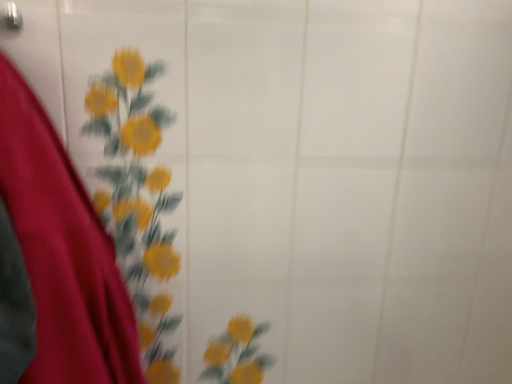
I want to click on velvet red dress at left, so click(x=56, y=259).

The image size is (512, 384). What do you see at coordinates (56, 259) in the screenshot?
I see `velvet red dress at left` at bounding box center [56, 259].

What is the approximate height of metallic silver door handle at upper left?

It is 1.77 inches.

Find the location of a particular element. This screenshot has height=384, width=512. metallic silver door handle at upper left is located at coordinates (10, 17).

Describe the element at coordinates (10, 17) in the screenshot. This screenshot has height=384, width=512. I see `metallic silver door handle at upper left` at that location.

In order to face metallic silver door handle at upper left, should I rotate leftwards or rightwards?

Turn left approximately 38.492 degrees to face it.

Identify the location of velvet red dress at left. (56, 259).

Based on the photo, which is more to the left, metallic silver door handle at upper left or velvet red dress at left?

From the viewer's perspective, metallic silver door handle at upper left appears more on the left side.

Considering the positions of objects metallic silver door handle at upper left and velvet red dress at left in the image provided, who is in front, metallic silver door handle at upper left or velvet red dress at left?

velvet red dress at left is in front.

Is point (12, 21) farther from viewer compared to point (59, 239)?

Yes, it is.

From the picture: From the image's perspective, does metallic silver door handle at upper left appear lower than velvet red dress at left?

No, from the image's perspective, metallic silver door handle at upper left is not below velvet red dress at left.

From a real-world perspective, is metallic silver door handle at upper left on top of velvet red dress at left?

Yes.

Considering the relative sizes of metallic silver door handle at upper left and velvet red dress at left in the image provided, is metallic silver door handle at upper left thinner than velvet red dress at left?

Yes, metallic silver door handle at upper left is thinner than velvet red dress at left.

Between metallic silver door handle at upper left and velvet red dress at left, which one has less height?

metallic silver door handle at upper left is shorter.

Is metallic silver door handle at upper left bigger or smaller than velvet red dress at left?

Considering their sizes, metallic silver door handle at upper left takes up less space than velvet red dress at left.

Based on the photo, is metallic silver door handle at upper left positioned beyond the bounds of velvet red dress at left?

That's correct, metallic silver door handle at upper left is outside of velvet red dress at left.

Is metallic silver door handle at upper left positioned far away from velvet red dress at left?

No, metallic silver door handle at upper left is not far from velvet red dress at left.

Could you tell me if metallic silver door handle at upper left is facing velvet red dress at left?

No, metallic silver door handle at upper left is not oriented towards velvet red dress at left.

Consider the image. What's the angular difference between metallic silver door handle at upper left and velvet red dress at left's facing directions?

The angular difference between metallic silver door handle at upper left and velvet red dress at left is 0.498 degrees.

The image size is (512, 384). Identify the location of dress located in front of the metallic silver door handle at upper left. (56, 259).

Considering the relative positions of velvet red dress at left and metallic silver door handle at upper left in the image provided, is velvet red dress at left to the right of metallic silver door handle at upper left from the viewer's perspective?

Correct, you'll find velvet red dress at left to the right of metallic silver door handle at upper left.

In the image, is velvet red dress at left positioned in front of or behind metallic silver door handle at upper left?

Visually, velvet red dress at left is located in front of metallic silver door handle at upper left.

Is point (110, 306) farther from camera compared to point (18, 13)?

Yes, it is behind point (18, 13).

From the image's perspective, which one is positioned lower, velvet red dress at left or metallic silver door handle at upper left?

velvet red dress at left appears lower in the image.

From a real-world perspective, which object rests below the other?

velvet red dress at left.

Considering the sizes of objects velvet red dress at left and metallic silver door handle at upper left in the image provided, who is thinner, velvet red dress at left or metallic silver door handle at upper left?

With smaller width is metallic silver door handle at upper left.

Does velvet red dress at left have a greater height compared to metallic silver door handle at upper left?

Yes, velvet red dress at left is taller than metallic silver door handle at upper left.

Is velvet red dress at left bigger or smaller than metallic silver door handle at upper left?

velvet red dress at left is bigger than metallic silver door handle at upper left.

Consider the image. Which is correct: velvet red dress at left is inside metallic silver door handle at upper left, or outside of it?

The correct answer is: outside.

Is velvet red dress at left far away from metallic silver door handle at upper left?

No, velvet red dress at left is in close proximity to metallic silver door handle at upper left.

Is velvet red dress at left aimed at metallic silver door handle at upper left?

No, velvet red dress at left is not oriented towards metallic silver door handle at upper left.

Locate an element on the screen. door handle above the velvet red dress at left (from a real-world perspective) is located at coordinates (10, 17).

You are a GUI agent. You are given a task and a screenshot of the screen. Output one action in this format:
    pyautogui.click(x=<x>, y=<y>)
    Task: Click on the dress below the metallic silver door handle at upper left (from a real-world perspective)
    The height and width of the screenshot is (384, 512).
    Given the screenshot: What is the action you would take?
    pyautogui.click(x=56, y=259)

This screenshot has height=384, width=512. I want to click on dress that is on the right side of metallic silver door handle at upper left, so click(x=56, y=259).